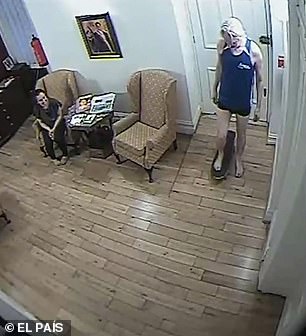
You are a GUI agent. You are given a task and a screenshot of the screen. Output one action in this format:
    pyautogui.click(x=<x>, y=<y>)
    Task: Click on the bottom drawer
    This screenshot has width=306, height=336.
    Given the screenshot: What is the action you would take?
    pyautogui.click(x=12, y=128)